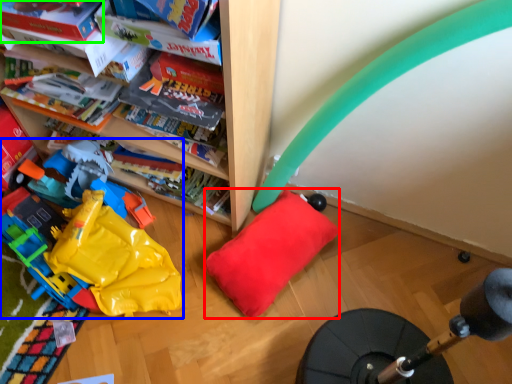
Question: Considering the real-world distances, which object is closest to pillow (highlighted by a red box)? toy (highlighted by a blue box) or book (highlighted by a green box).

Choices:
 (A) toy
 (B) book

Answer: (A)